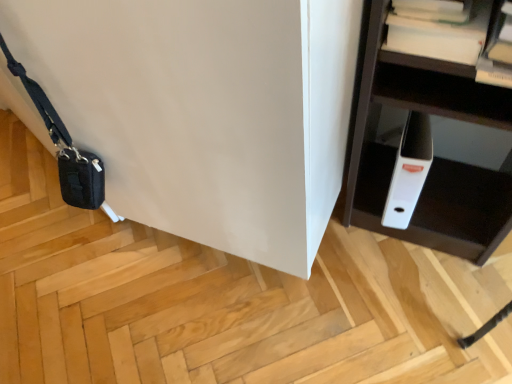
Question: Is point (484, 1) closer or farther from the camera than point (92, 201)?

Choices:
 (A) farther
 (B) closer

Answer: (B)

Question: From the image's perspective, is white paper at upper right located above or below black fabric messenger bag at lower left?

Choices:
 (A) above
 (B) below

Answer: (A)

Question: In terms of width, does white paper at upper right look wider or thinner when compared to black fabric messenger bag at lower left?

Choices:
 (A) wide
 (B) thin

Answer: (A)

Question: In terms of width, does black fabric messenger bag at lower left look wider or thinner when compared to white paper at upper right?

Choices:
 (A) thin
 (B) wide

Answer: (A)

Question: Considering the positions of black fabric messenger bag at lower left and white paper at upper right in the image, is black fabric messenger bag at lower left taller or shorter than white paper at upper right?

Choices:
 (A) short
 (B) tall

Answer: (B)

Question: Is black fabric messenger bag at lower left in front of or behind white paper at upper right in the image?

Choices:
 (A) behind
 (B) front

Answer: (A)

Question: Considering the positions of black fabric messenger bag at lower left and white paper at upper right in the image, is black fabric messenger bag at lower left bigger or smaller than white paper at upper right?

Choices:
 (A) big
 (B) small

Answer: (A)